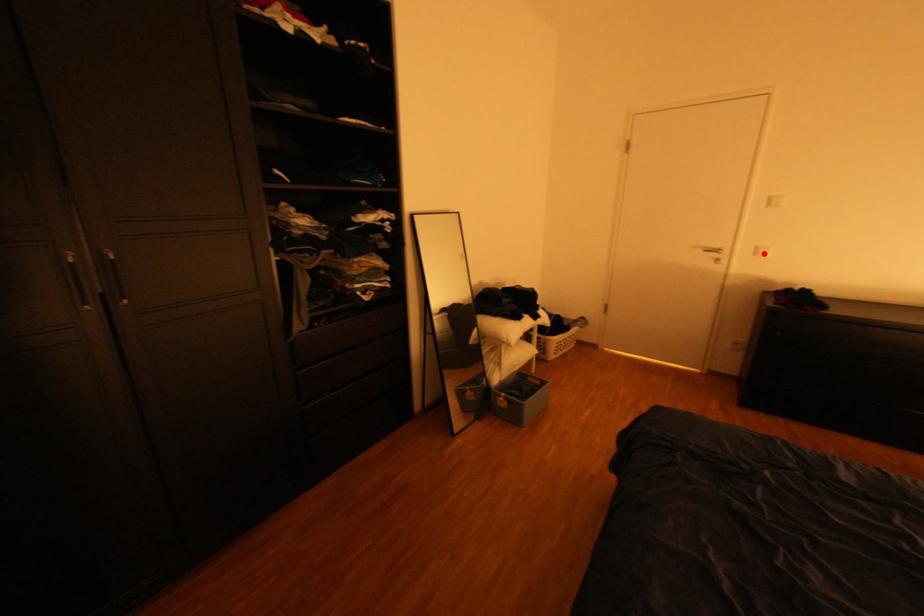
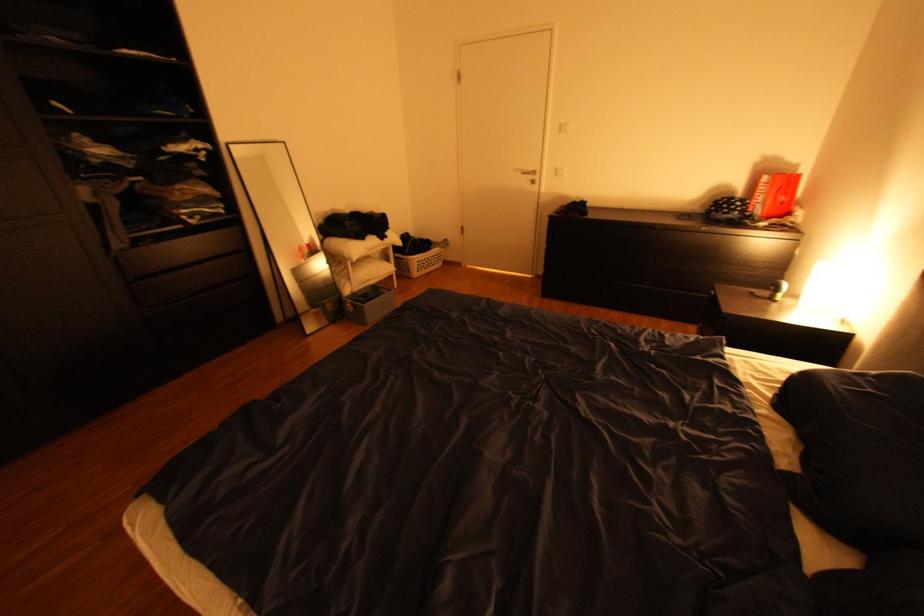
Question: A red point is marked in image1. In image2, is the corresponding 3D point closer to the camera or farther? Reply with the corresponding letter.

Choices:
 (A) The corresponding 3D point is closer.
 (B) The corresponding 3D point is farther.

Answer: (A)